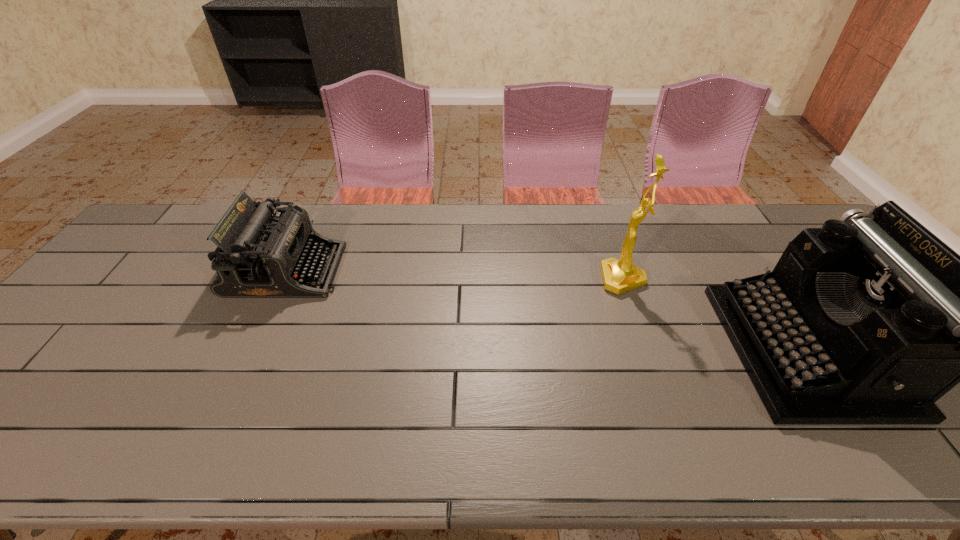
Identify the location of vacant area located on the typing side of the second shortest object. The width and height of the screenshot is (960, 540). (626, 349).

What are the coordinates of `vacant area situated on the keyboard of the shortest object` in the screenshot? It's located at (378, 271).

At what (x,y) coordinates should I click in order to perform the action: click on object that is at the far edge. Please return your answer as a coordinate pair (x, y). Looking at the image, I should click on (260, 255).

Find the location of a particular element. The height and width of the screenshot is (540, 960). object present at the near edge is located at coordinates (869, 320).

Where is `object at the right edge`? object at the right edge is located at coordinates (869, 320).

This screenshot has height=540, width=960. In order to click on object located in the near right corner section of the desktop in this screenshot , I will do `click(869, 320)`.

Locate an element on the screen. The height and width of the screenshot is (540, 960). blank space at the far edge is located at coordinates (382, 229).

This screenshot has width=960, height=540. I want to click on free space at the near edge of the desktop, so click(x=948, y=464).

The height and width of the screenshot is (540, 960). In order to click on vacant space at the left edge of the desktop in this screenshot , I will do `click(164, 247)`.

Locate an element on the screen. The image size is (960, 540). empty space between the second object from left to right and the right typewriter is located at coordinates (714, 314).